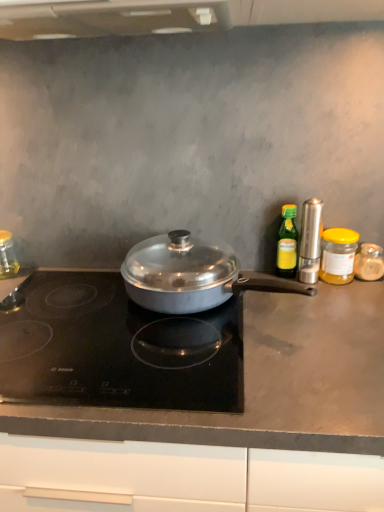
Where is `free space that is to the left of satin silver pepper mill at right, acting as the third kitchen appliance starting from the right`? Image resolution: width=384 pixels, height=512 pixels. free space that is to the left of satin silver pepper mill at right, acting as the third kitchen appliance starting from the right is located at coordinates (266, 293).